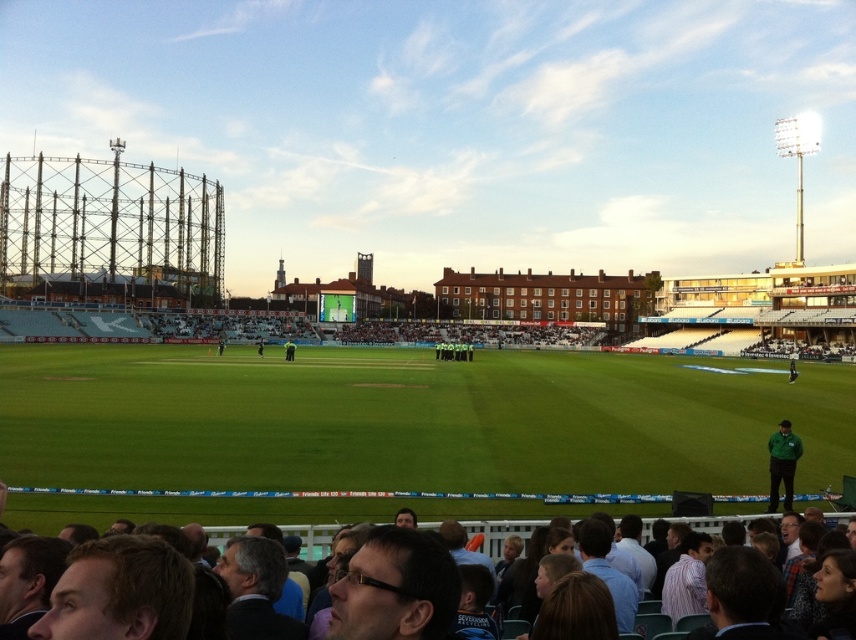
Question: Observing the image, what is the correct spatial positioning of green grass football field at center in reference to green fabric jacket at lower right?

Choices:
 (A) below
 (B) above

Answer: (B)

Question: Which of these objects is positioned farthest from the green uniform at center?

Choices:
 (A) green grass football field at center
 (B) green fabric jacket at lower right

Answer: (B)

Question: Which point is farther from the camera taking this photo?

Choices:
 (A) (289, 348)
 (B) (789, 486)

Answer: (A)

Question: From the image, what is the correct spatial relationship of dark brown leather jacket at lower center in relation to green uniform at center?

Choices:
 (A) above
 (B) below

Answer: (B)

Question: From the image, what is the correct spatial relationship of dark brown leather jacket at lower center in relation to green fabric jacket at lower right?

Choices:
 (A) left
 (B) right

Answer: (A)

Question: Which point is farther to the camera?

Choices:
 (A) green fabric jacket at lower right
 (B) green uniform at center
 (C) green grass football field at center
 (D) dark brown leather jacket at lower center

Answer: (B)